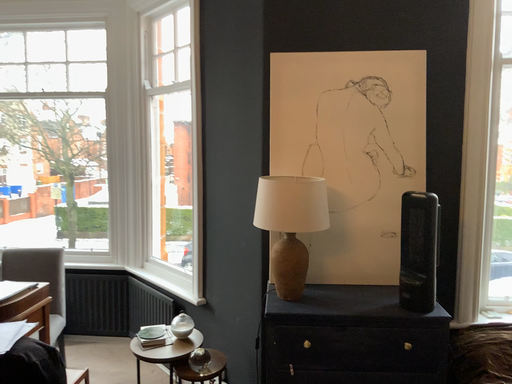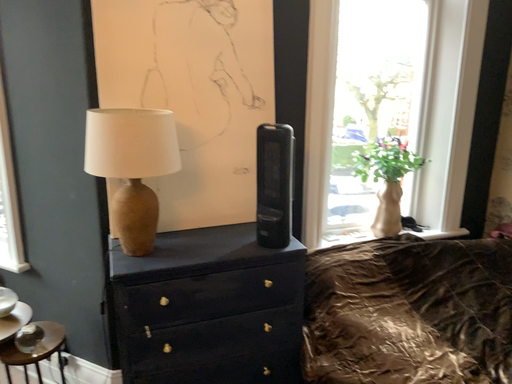
Question: Which way did the camera rotate in the video?

Choices:
 (A) rotated downward
 (B) rotated upward

Answer: (A)